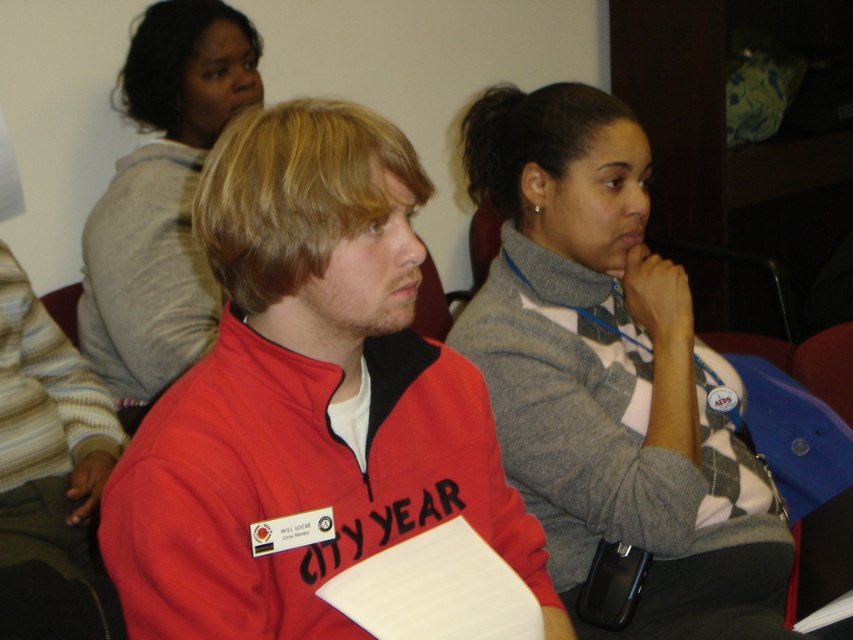
You are attending a meeting and see two people in the front row wearing the red fleece sweatshirt at center and the gray sweater at center. Which one is sitting on the left side?

The red fleece sweatshirt at center is sitting on the left side of the gray sweater at center.